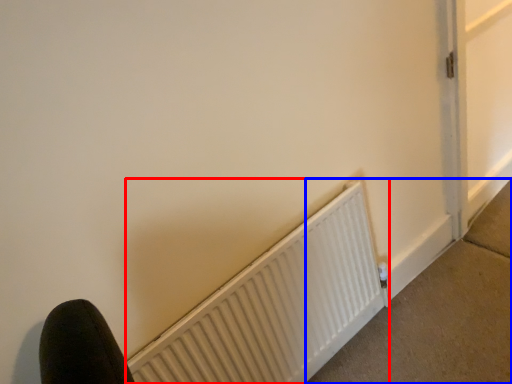
Question: Which object appears farthest to the camera in this image, radiator (highlighted by a red box) or concrete (highlighted by a blue box)?

Choices:
 (A) radiator
 (B) concrete

Answer: (B)